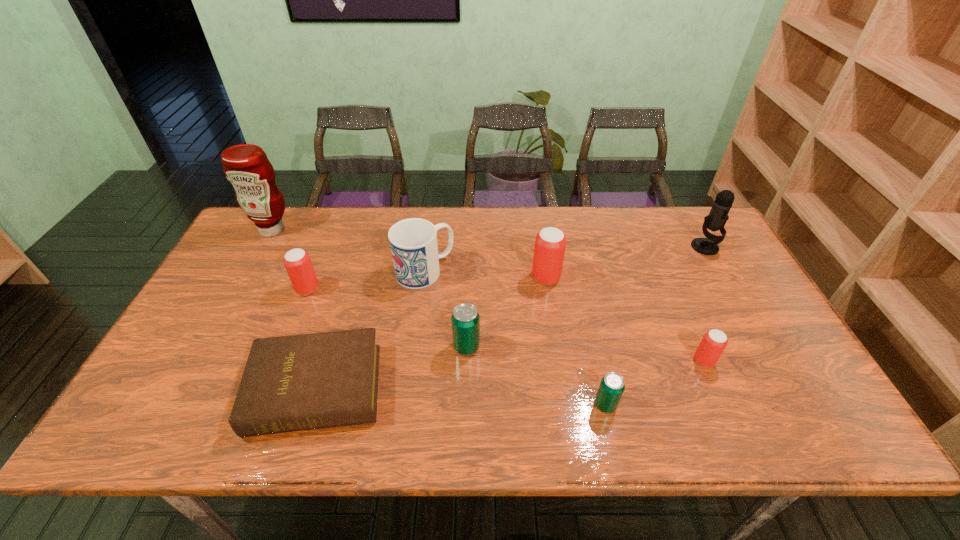
The image size is (960, 540). I want to click on free space between the bigger teal beer can and the microphone, so click(x=586, y=297).

Locate an element on the screen. The width and height of the screenshot is (960, 540). free space between the red condiment and the smaller teal beer can is located at coordinates (439, 317).

Where is `unoccupied position between the second biggest red beer can and the mug`? Image resolution: width=960 pixels, height=540 pixels. unoccupied position between the second biggest red beer can and the mug is located at coordinates (366, 280).

Where is `free space between the rightmost object and the blue mug`? This screenshot has height=540, width=960. free space between the rightmost object and the blue mug is located at coordinates click(564, 259).

Locate an element on the screen. The width and height of the screenshot is (960, 540). vacant area between the fourth object from right to left and the smaller teal beer can is located at coordinates tap(576, 341).

The image size is (960, 540). In order to click on empty location between the third beer can from left to right and the blue mug in this screenshot , I will do `click(486, 274)`.

The image size is (960, 540). In order to click on object that is the fourth closest one to the leftmost beer can in this screenshot , I will do `click(465, 319)`.

Select which object is the second closest to the second beer can from right to left. Please provide its 2D coordinates. Your answer should be formatted as a tuple, i.e. [(x, y)], where the tuple contains the x and y coordinates of a point satisfying the conditions above.

[(465, 319)]

In order to click on beer can that can be found as the fifth closest to the black microphone in this screenshot , I will do click(x=297, y=262).

Identify which beer can is the closest to the farther teal beer can. Please provide its 2D coordinates. Your answer should be formatted as a tuple, i.e. [(x, y)], where the tuple contains the x and y coordinates of a point satisfying the conditions above.

[(550, 243)]